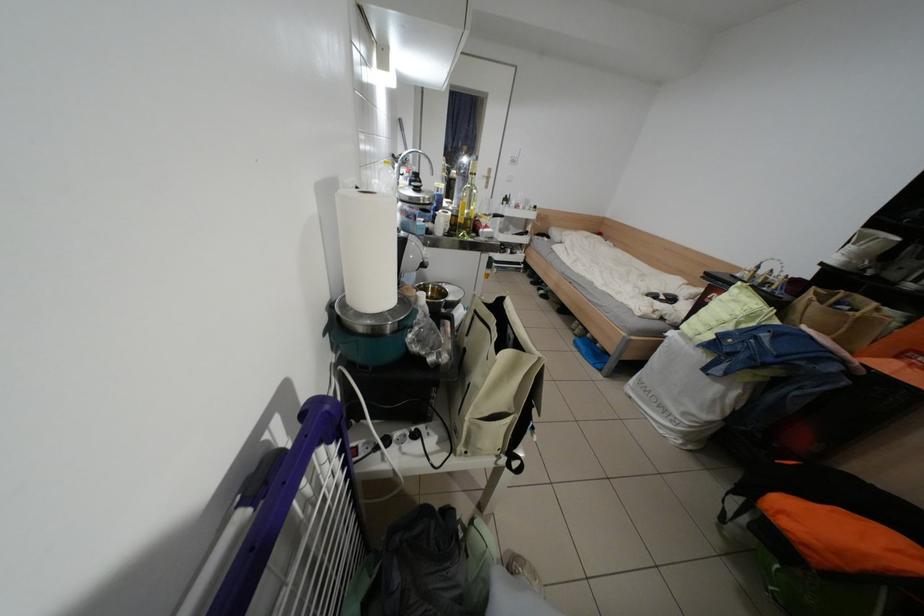
What are the coordinates of `white boot` in the screenshot? It's located at (521, 569).